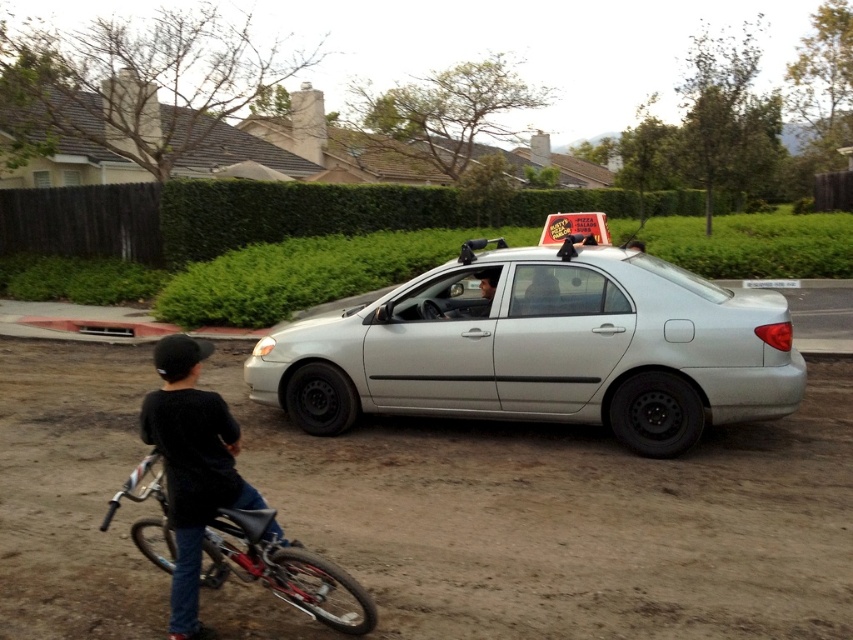
Question: In this image, where is dirt track at lower left located relative to black matte shirt at lower left?

Choices:
 (A) left
 (B) right

Answer: (B)

Question: Which point is closer to the camera?

Choices:
 (A) (778, 288)
 (B) (155, 474)
 (C) (376, 392)

Answer: (B)

Question: Can you confirm if black matte shirt at lower left is positioned below reddish metallic bicycle at lower left?

Choices:
 (A) yes
 (B) no

Answer: (B)

Question: Which point is farther from the camera taking this photo?

Choices:
 (A) (503, 428)
 (B) (163, 428)
 (C) (747, 284)
 (D) (370, 611)

Answer: (C)

Question: Among these points, which one is nearest to the camera?

Choices:
 (A) tap(762, 285)
 (B) tap(421, 355)
 (C) tap(303, 611)
 (D) tap(175, 573)

Answer: (D)

Question: Is silver metallic sedan at center above reddish metallic bicycle at lower left?

Choices:
 (A) no
 (B) yes

Answer: (B)